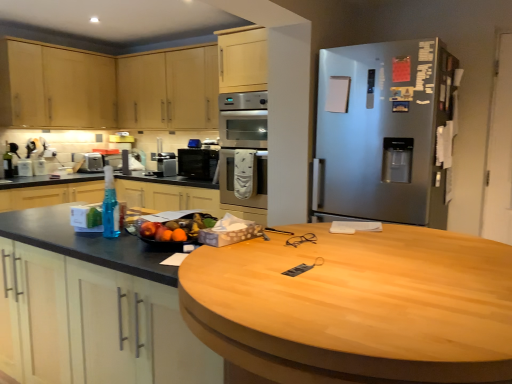
Find the location of a particular element. light wood cabinet at upper left, which appears as the first cabinetry when viewed from the left is located at coordinates (55, 87).

Measure the distance between satin black coffee maker at center, acting as the 2th appliance starting from the back, and camera.

3.99 meters.

The width and height of the screenshot is (512, 384). Find the location of `green glass bottle at left, marked as the 2th bottle in a right-to-left arrangement`. green glass bottle at left, marked as the 2th bottle in a right-to-left arrangement is located at coordinates (8, 161).

This screenshot has width=512, height=384. Find the location of `shiny plastic bowl of mixed fruits at center`. shiny plastic bowl of mixed fruits at center is located at coordinates 176,228.

From a real-world perspective, which is physically below, shiny plastic bowl of mixed fruits at center or blue translucent spray bottle at left, positioned as the second bottle in back-to-front order?

shiny plastic bowl of mixed fruits at center, from a real-world perspective.

Which is closer to the camera, (158, 215) or (109, 166)?

The point (158, 215) is more forward.

Is shiny plastic bowl of mixed fruits at center bigger or smaller than blue translucent spray bottle at left, marked as the first bottle in a bottom-to-top arrangement?

Clearly, shiny plastic bowl of mixed fruits at center is larger in size than blue translucent spray bottle at left, marked as the first bottle in a bottom-to-top arrangement.

Between light wood cabinet at upper left, placed as the first cabinetry when sorted from right to left, and shiny plastic bowl of mixed fruits at center, which one has smaller size?

shiny plastic bowl of mixed fruits at center.

Which is closer, (145, 65) or (189, 227)?

Point (145, 65).

Is light wood cabinet at upper left, which is the 2th cabinetry in left-to-right order, wider than shiny plastic bowl of mixed fruits at center?

No, light wood cabinet at upper left, which is the 2th cabinetry in left-to-right order, is not wider than shiny plastic bowl of mixed fruits at center.

Is light wood cabinet at upper left, placed as the first cabinetry when sorted from right to left, oriented towards shiny plastic bowl of mixed fruits at center?

No, light wood cabinet at upper left, placed as the first cabinetry when sorted from right to left, is not aimed at shiny plastic bowl of mixed fruits at center.

From a real-world perspective, is light wood cabinet at upper left, which is the 2th cabinetry in left-to-right order, positioned under satin silver oven at center based on gravity?

No, from a real-world perspective, light wood cabinet at upper left, which is the 2th cabinetry in left-to-right order, is not under satin silver oven at center.

Is light wood cabinet at upper left, placed as the first cabinetry when sorted from right to left, bigger or smaller than satin silver oven at center?

Considering their sizes, light wood cabinet at upper left, placed as the first cabinetry when sorted from right to left, takes up more space than satin silver oven at center.

Does light wood cabinet at upper left, which is the 2th cabinetry in left-to-right order, have a greater width compared to satin silver oven at center?

In fact, light wood cabinet at upper left, which is the 2th cabinetry in left-to-right order, might be narrower than satin silver oven at center.

Considering the relative sizes of light wood cabinet at upper left, which is the 2th cabinetry in left-to-right order, and satin silver oven at center in the image provided, is light wood cabinet at upper left, which is the 2th cabinetry in left-to-right order, shorter than satin silver oven at center?

Yes.

Relative to shiny plastic bowl of mixed fruits at center, is satin silver oven at center in front or behind?

Clearly, satin silver oven at center is behind shiny plastic bowl of mixed fruits at center.

Can you confirm if satin silver oven at center is wider than shiny plastic bowl of mixed fruits at center?

Indeed, satin silver oven at center has a greater width compared to shiny plastic bowl of mixed fruits at center.

Is satin silver oven at center in contact with shiny plastic bowl of mixed fruits at center?

No, satin silver oven at center is not next to shiny plastic bowl of mixed fruits at center.

Does point (234, 125) appear closer or farther from the camera than point (165, 223)?

Clearly, point (234, 125) is more distant from the camera than point (165, 223).

Is black glass microwave at center at the back of satin silver oven at center?

satin silver oven at center is not turned away from black glass microwave at center.

Would you say satin silver oven at center is inside or outside black glass microwave at center?

satin silver oven at center is not inside black glass microwave at center, it's outside.

Is there a large distance between satin silver oven at center and black glass microwave at center?

No, satin silver oven at center is not far away from black glass microwave at center.

From a real-world perspective, is satin silver oven at center positioned over black glass microwave at center based on gravity?

Indeed, from a real-world perspective, satin silver oven at center stands above black glass microwave at center.

Is point (170, 166) farther from viewer compared to point (145, 234)?

Yes, point (170, 166) is farther from viewer.

Is satin black coffee maker at center, acting as the first appliance starting from the right, bigger or smaller than shiny plastic bowl of mixed fruits at center?

satin black coffee maker at center, acting as the first appliance starting from the right, is smaller than shiny plastic bowl of mixed fruits at center.

From a real-world perspective, which is physically above, satin black coffee maker at center, acting as the 2th appliance starting from the back, or shiny plastic bowl of mixed fruits at center?

From a 3D spatial view, satin black coffee maker at center, acting as the 2th appliance starting from the back, is above.

From the image's perspective, does matte black countertop at left appear lower than green glass bottle at left, arranged as the 2th bottle when ordered from the bottom?

Yes.

Looking at this image, is matte black countertop at left outside of green glass bottle at left, acting as the first bottle starting from the back?

That's correct, matte black countertop at left is outside of green glass bottle at left, acting as the first bottle starting from the back.

Can you confirm if matte black countertop at left is thinner than green glass bottle at left, the second bottle viewed from the front?

No.

From a real-world perspective, which is physically above, matte black countertop at left or green glass bottle at left, the first bottle from the left?

green glass bottle at left, the first bottle from the left, from a real-world perspective.

Find the location of a particular element. Image resolution: width=512 pixels, height=384 pixels. fruit behind the blue translucent spray bottle at left, which ranks as the second bottle in left-to-right order is located at coordinates (176, 228).

This screenshot has width=512, height=384. Identify the location of fruit to the right of light wood cabinet at upper left, which is the 2th cabinetry in left-to-right order. (176, 228).

Estimate the real-world distances between objects in this image. Which object is further from satin silver toaster at left, the 1th appliance from the left, light wood cabinet at upper left, which is the 2th cabinetry in left-to-right order, or satin black coffee maker at center, marked as the 2th appliance in a left-to-right arrangement?

light wood cabinet at upper left, which is the 2th cabinetry in left-to-right order, lies further to satin silver toaster at left, the 1th appliance from the left, than the other object.

Based on their spatial positions, is green glass bottle at left, the second bottle viewed from the front, or black glass microwave at center closer to satin silver refrigerator at right?

Based on the image, black glass microwave at center appears to be nearer to satin silver refrigerator at right.

Which object lies further to the anchor point satin silver toaster at left, positioned as the 2th appliance in front-to-back order, green glass bottle at left, which appears as the 1th bottle when viewed from the top, or shiny plastic bowl of mixed fruits at center?

shiny plastic bowl of mixed fruits at center lies further to satin silver toaster at left, positioned as the 2th appliance in front-to-back order, than the other object.

Based on their spatial positions, is satin silver toaster at left, the first appliance from the back, or matte black countertop at left further from satin silver refrigerator at right?

satin silver toaster at left, the first appliance from the back, lies further to satin silver refrigerator at right than the other object.

Which object lies nearer to the anchor point satin silver oven at center, light wood cabinet at upper left, acting as the second cabinetry starting from the right, or black glass microwave at center?

black glass microwave at center is positioned closer to the anchor satin silver oven at center.

Estimate the real-world distances between objects in this image. Which object is closer to light wood cabinet at upper left, which is the 2th cabinetry in left-to-right order, black glass microwave at center or satin silver refrigerator at right?

black glass microwave at center is closer to light wood cabinet at upper left, which is the 2th cabinetry in left-to-right order.

In the scene shown: Considering their positions, is light wood cabinet at upper left, which is the 2th cabinetry in left-to-right order, positioned further to matte black countertop at left than blue translucent spray bottle at left, which ranks as the second bottle in left-to-right order?

Among the two, blue translucent spray bottle at left, which ranks as the second bottle in left-to-right order, is located further to matte black countertop at left.

Which object lies nearer to the anchor point black glass microwave at center, shiny plastic bowl of mixed fruits at center or light wood cabinet at upper left, which appears as the first cabinetry when viewed from the left?

The object closer to black glass microwave at center is light wood cabinet at upper left, which appears as the first cabinetry when viewed from the left.

Locate an element on the screen. The height and width of the screenshot is (384, 512). fruit between blue translucent spray bottle at left, placed as the 2th bottle when sorted from top to bottom, and satin silver refrigerator at right is located at coordinates (176, 228).

You are a GUI agent. You are given a task and a screenshot of the screen. Output one action in this format:
    pyautogui.click(x=<x>, y=<y>)
    Task: Click on the cabinetry positioned between matte black countertop at left and light wood cabinet at upper left, which is the 2th cabinetry in left-to-right order, from near to far
    This screenshot has width=512, height=384.
    Given the screenshot: What is the action you would take?
    pyautogui.click(x=55, y=87)

At what (x,y) coordinates should I click in order to perform the action: click on bottle between shiny plastic bowl of mixed fruits at center and satin silver toaster at left, positioned as the 2th appliance in front-to-back order, from front to back. Please return your answer as a coordinate pair (x, y). Looking at the image, I should click on coord(8,161).

Locate an element on the screen. The height and width of the screenshot is (384, 512). fruit between matte black countertop at left and satin silver oven at center from front to back is located at coordinates (176, 228).